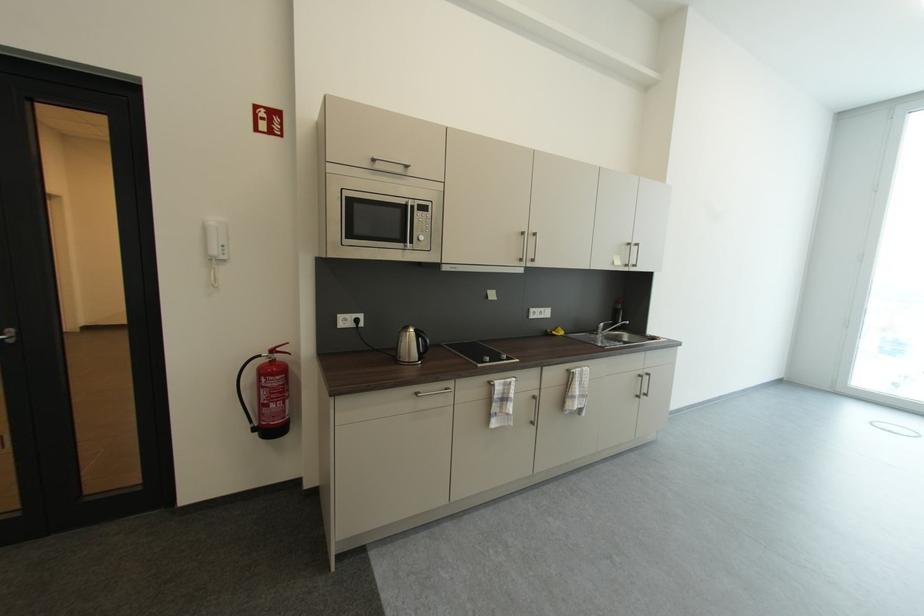
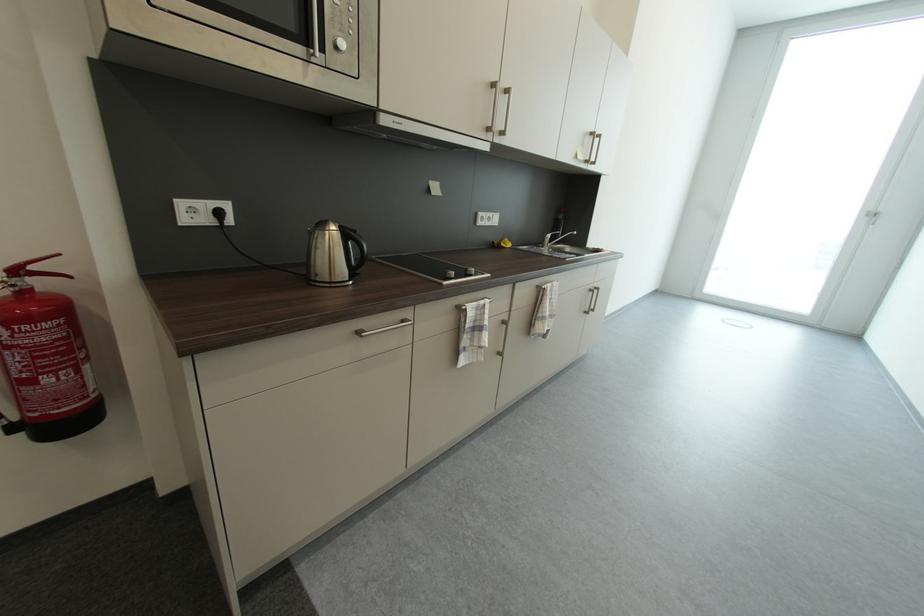
In the second image, find the point that corresponds to pixel 274 358 in the first image.

(8, 284)